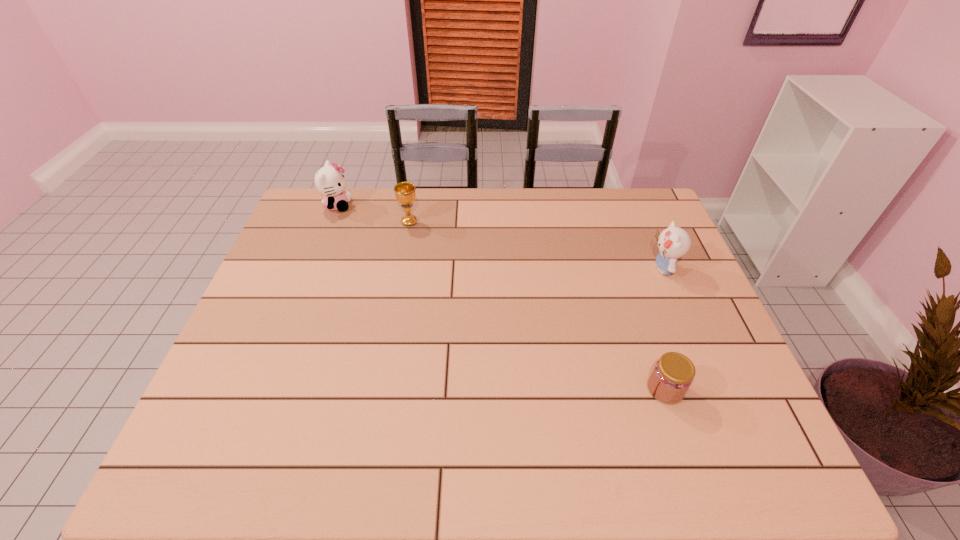
The width and height of the screenshot is (960, 540). Find the location of `the left kitten`. the left kitten is located at coordinates (329, 181).

I want to click on the leftmost object, so click(x=329, y=181).

The width and height of the screenshot is (960, 540). What are the coordinates of `the rightmost object` in the screenshot? It's located at (674, 242).

This screenshot has width=960, height=540. In order to click on the right kitten in this screenshot , I will do `click(674, 242)`.

You are a GUI agent. You are given a task and a screenshot of the screen. Output one action in this format:
    pyautogui.click(x=<x>, y=<y>)
    Task: Click on the chalice
    The image size is (960, 540).
    Given the screenshot: What is the action you would take?
    pyautogui.click(x=405, y=194)

In order to click on the shortest object in this screenshot , I will do `click(673, 374)`.

The image size is (960, 540). In order to click on jam in this screenshot , I will do `click(673, 374)`.

The image size is (960, 540). Find the location of `vacant space located 0.270m on the front-facing side of the left kitten`. vacant space located 0.270m on the front-facing side of the left kitten is located at coordinates (430, 205).

Locate an element on the screen. vacant point located 0.380m on the front-facing side of the nearer kitten is located at coordinates (519, 268).

Where is `vacant space located on the front-facing side of the nearer kitten`? Image resolution: width=960 pixels, height=540 pixels. vacant space located on the front-facing side of the nearer kitten is located at coordinates (533, 268).